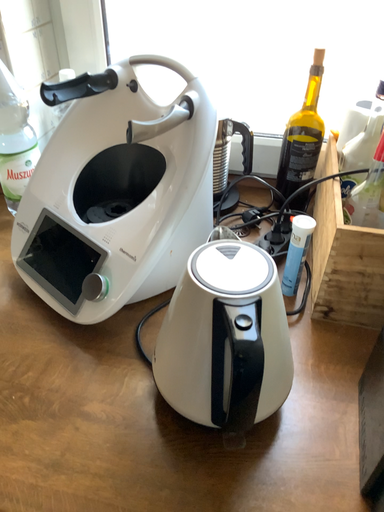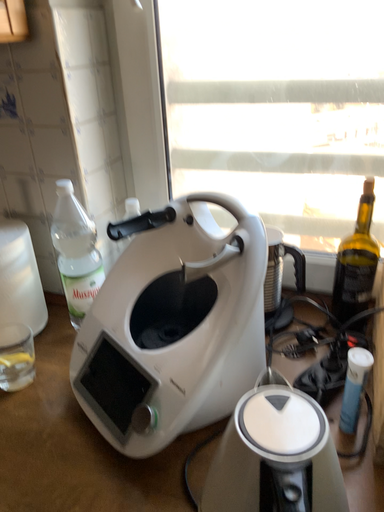
Question: Which way did the camera rotate in the video?

Choices:
 (A) rotated upward
 (B) rotated downward

Answer: (A)